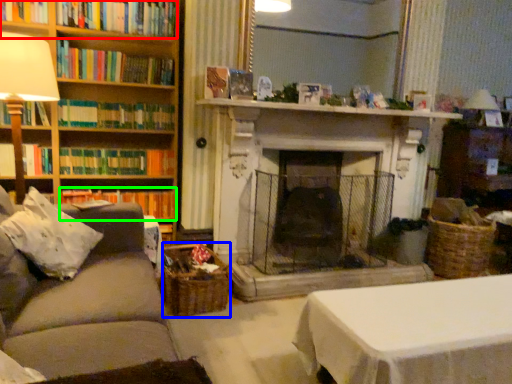
Question: Which object is positioned closest to book (highlighted by a red box)? Select from basket (highlighted by a blue box) and book (highlighted by a green box).

Choices:
 (A) basket
 (B) book

Answer: (B)